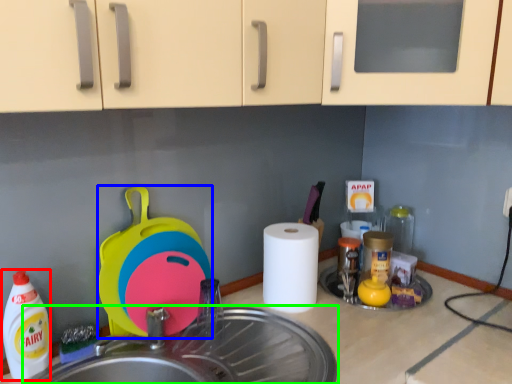
Question: Estimate the real-world distances between objects in this image. Which object is closer to cleaning product (highlighted by a red box), appliance (highlighted by a blue box) or sink (highlighted by a green box)?

Choices:
 (A) appliance
 (B) sink

Answer: (A)